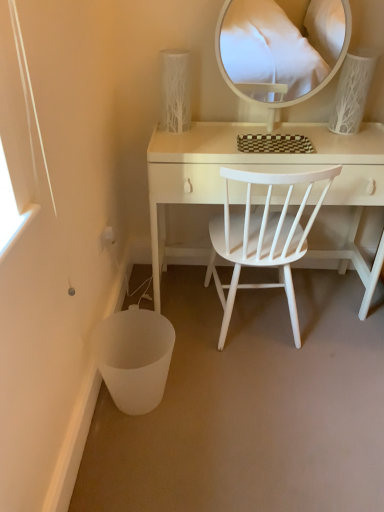
At what (x,y) coordinates should I click in order to perform the action: click on empty space that is in between white textured vase at upper center, which ranks as the 1th table lamp in left-to-right order, and white textured vase at upper right, the second table lamp positioned from the left. Please return your answer as a coordinate pair (x, y). Looking at the image, I should click on (259, 128).